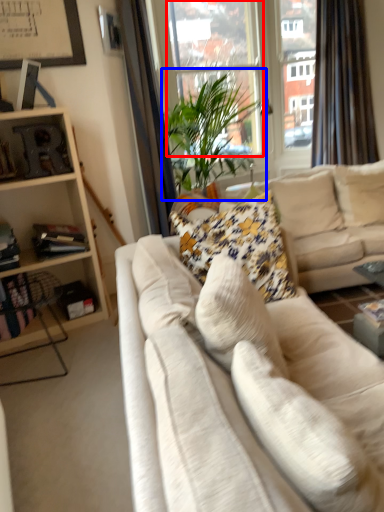
Question: Which point is further to the camera, window screen (highlighted by a red box) or houseplant (highlighted by a blue box)?

Choices:
 (A) window screen
 (B) houseplant

Answer: (A)